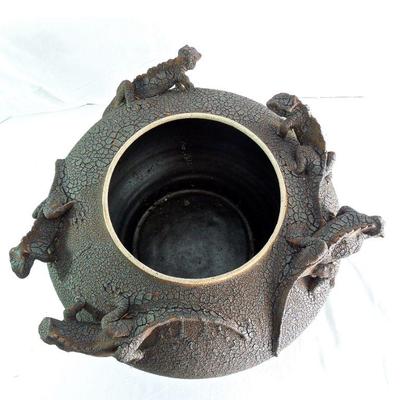
The height and width of the screenshot is (400, 400). In order to click on pot in this screenshot , I will do `click(248, 300)`.